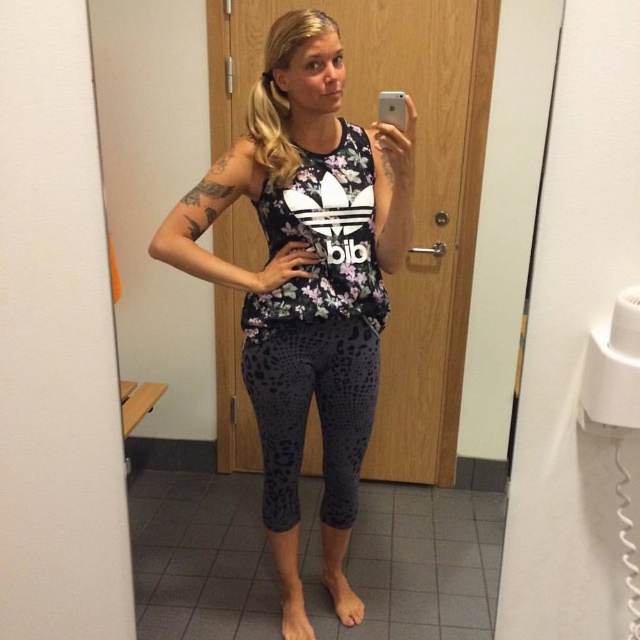
Question: Is floral fabric tank top at center further to the viewer compared to dark gray leopard print leggings at center?

Choices:
 (A) no
 (B) yes

Answer: (A)

Question: Where is floral fabric tank top at center located in relation to dark gray leopard print leggings at center in the image?

Choices:
 (A) left
 (B) right

Answer: (A)

Question: Can you confirm if floral fabric tank top at center is bigger than dark gray leopard print leggings at center?

Choices:
 (A) no
 (B) yes

Answer: (B)

Question: Which of the following is the farthest from the observer?

Choices:
 (A) (230, 154)
 (B) (292, 387)

Answer: (B)

Question: Which point is closer to the camera?

Choices:
 (A) (346, 360)
 (B) (269, 470)

Answer: (A)